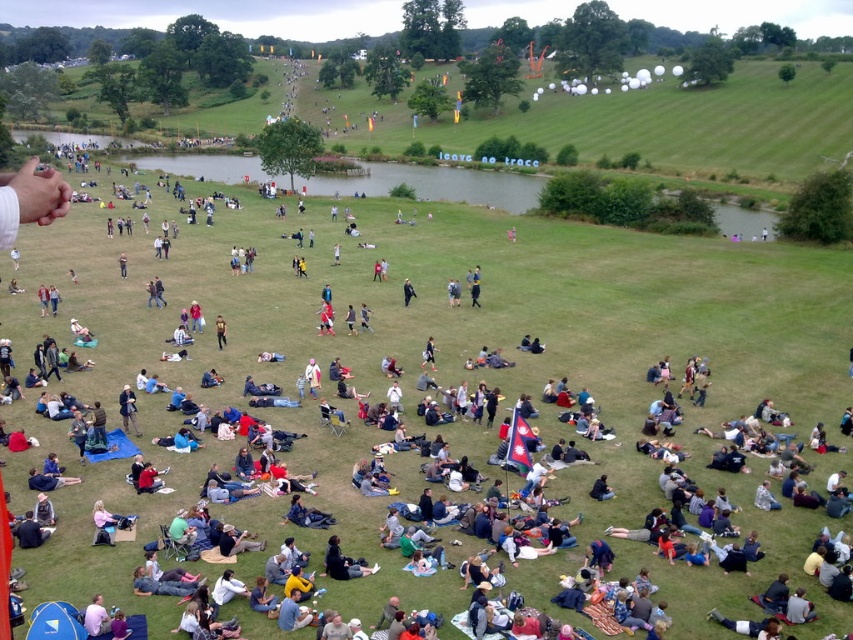
Can you confirm if dark blue fabric jacket at center is positioned above brown leather jacket at center?

Incorrect, dark blue fabric jacket at center is not positioned above brown leather jacket at center.

Can you confirm if dark blue fabric jacket at center is positioned to the right of brown leather jacket at center?

No, dark blue fabric jacket at center is not to the right of brown leather jacket at center.

In the scene shown: Who is more forward, [123,413] or [216,333]?

Point [123,413] is more forward.

Where is `dark blue fabric jacket at center`? This screenshot has width=853, height=640. dark blue fabric jacket at center is located at coordinates (128, 410).